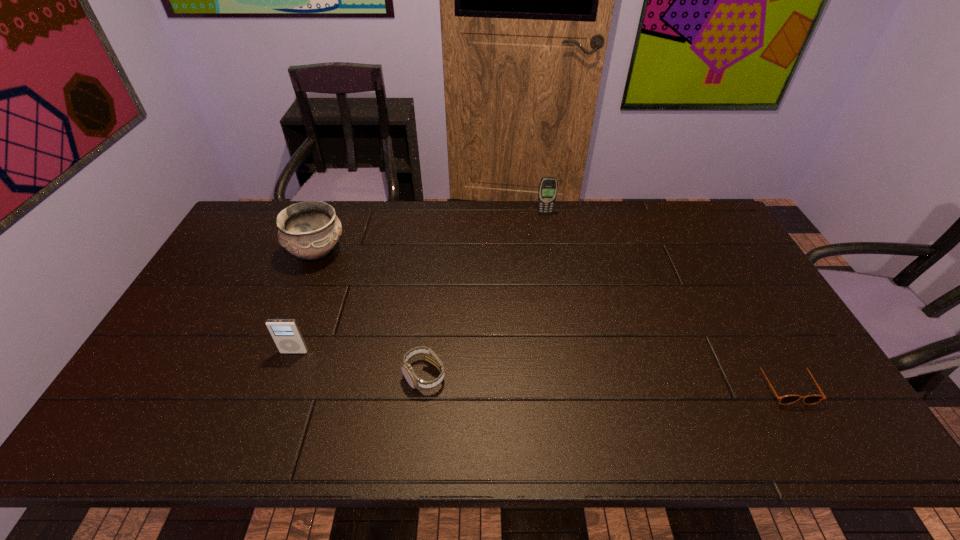
I want to click on free location located 0.390m on the right of the pottery, so click(x=465, y=252).

Locate an element on the screen. This screenshot has width=960, height=540. vacant space located on the front-facing side of the third tallest object is located at coordinates (279, 391).

Identify the location of vacant space located 0.100m on the front-facing side of the rightmost object. The height and width of the screenshot is (540, 960). (820, 446).

The height and width of the screenshot is (540, 960). I want to click on cellular telephone positioned at the far edge, so click(x=548, y=186).

You are a GUI agent. You are given a task and a screenshot of the screen. Output one action in this format:
    pyautogui.click(x=<x>, y=<y>)
    Task: Click on the pottery at the far edge
    The width and height of the screenshot is (960, 540).
    Given the screenshot: What is the action you would take?
    pyautogui.click(x=309, y=230)

Locate an element on the screen. The width and height of the screenshot is (960, 540). object present at the right edge is located at coordinates (787, 399).

Where is `vacant space at the far edge`? vacant space at the far edge is located at coordinates (482, 208).

The height and width of the screenshot is (540, 960). In order to click on free spot at the near edge of the desktop in this screenshot , I will do `click(284, 444)`.

What are the coordinates of `blank space at the left edge` in the screenshot? It's located at (244, 284).

In the image, there is a desktop. Identify the location of free space at the right edge. The image size is (960, 540). (780, 346).